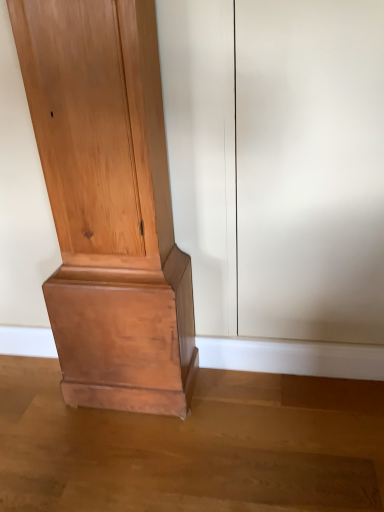
I want to click on free location to the right of matte wood cabinet at left, so click(241, 407).